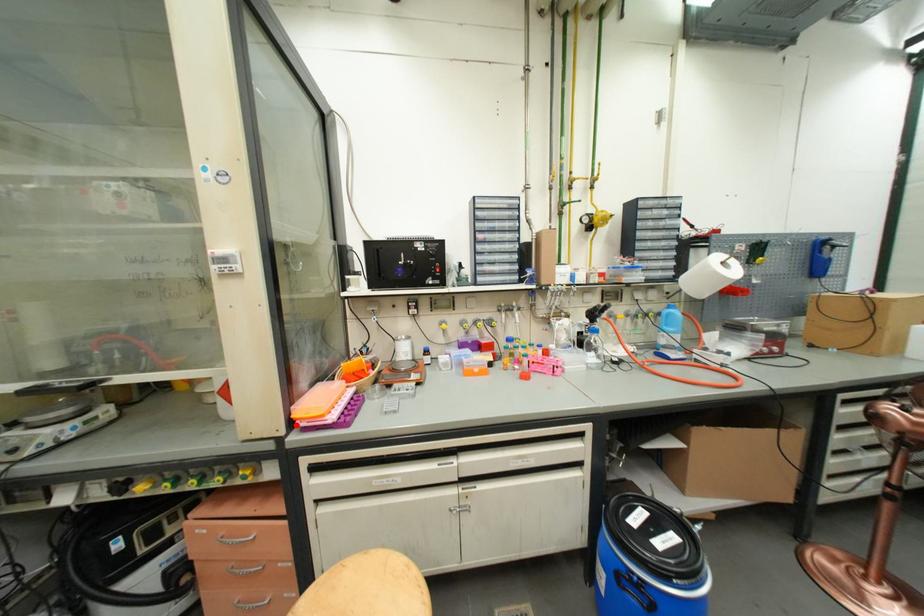
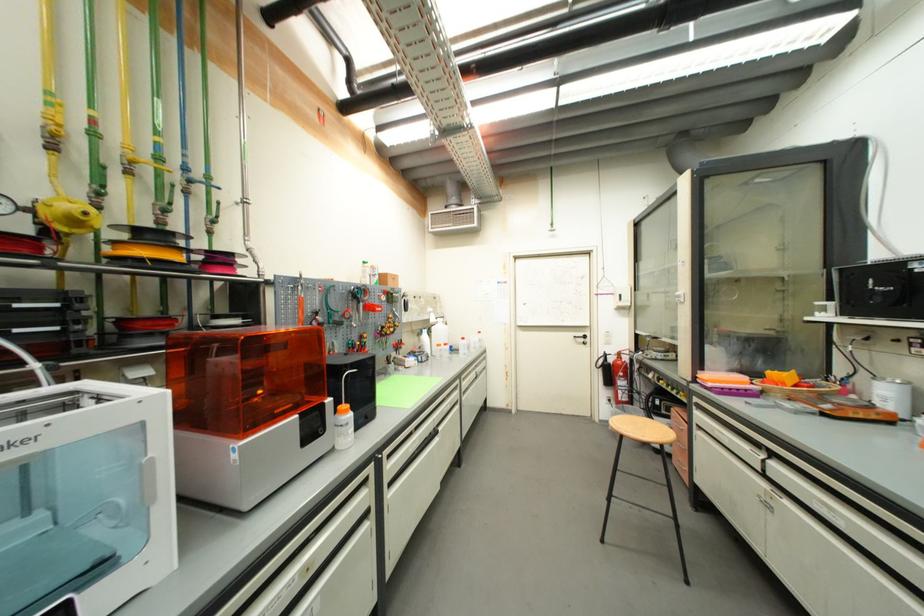
Question: I am providing you with two images of the same scene from different viewpoints. A red point is marked on the first image. Can you still see the location of the red point in image 2?

Choices:
 (A) Yes
 (B) No

Answer: (A)